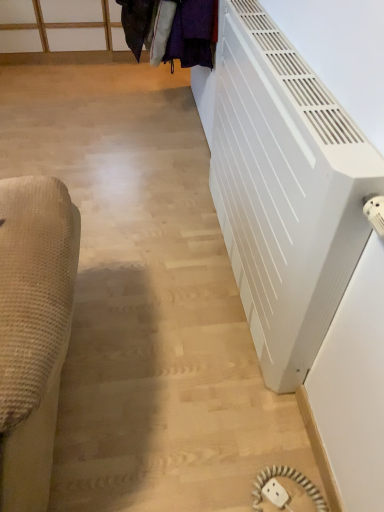
Question: Considering the relative positions of white matte radiator at right and velvet purple coat at upper center in the image provided, is white matte radiator at right to the right of velvet purple coat at upper center from the viewer's perspective?

Choices:
 (A) yes
 (B) no

Answer: (A)

Question: From a real-world perspective, is white matte radiator at right positioned over velvet purple coat at upper center based on gravity?

Choices:
 (A) yes
 (B) no

Answer: (B)

Question: Is the position of white matte radiator at right more distant than that of velvet purple coat at upper center?

Choices:
 (A) no
 (B) yes

Answer: (A)

Question: From the image's perspective, is white matte radiator at right on top of velvet purple coat at upper center?

Choices:
 (A) yes
 (B) no

Answer: (B)

Question: From the image's perspective, is white matte radiator at right beneath velvet purple coat at upper center?

Choices:
 (A) no
 (B) yes

Answer: (B)

Question: Does white matte radiator at right have a smaller size compared to velvet purple coat at upper center?

Choices:
 (A) no
 (B) yes

Answer: (A)

Question: From the image's perspective, is velvet purple coat at upper center under white plastic outlet at lower right?

Choices:
 (A) yes
 (B) no

Answer: (B)

Question: Can you confirm if velvet purple coat at upper center is positioned to the right of white plastic outlet at lower right?

Choices:
 (A) yes
 (B) no

Answer: (B)

Question: From a real-world perspective, does velvet purple coat at upper center stand above white plastic outlet at lower right?

Choices:
 (A) yes
 (B) no

Answer: (A)

Question: From a real-world perspective, is velvet purple coat at upper center beneath white plastic outlet at lower right?

Choices:
 (A) no
 (B) yes

Answer: (A)

Question: Does velvet purple coat at upper center have a smaller size compared to white plastic outlet at lower right?

Choices:
 (A) yes
 (B) no

Answer: (B)

Question: Is velvet purple coat at upper center closer to the viewer compared to white plastic outlet at lower right?

Choices:
 (A) yes
 (B) no

Answer: (B)

Question: Does white plastic outlet at lower right have a smaller size compared to white matte radiator at right?

Choices:
 (A) yes
 (B) no

Answer: (A)